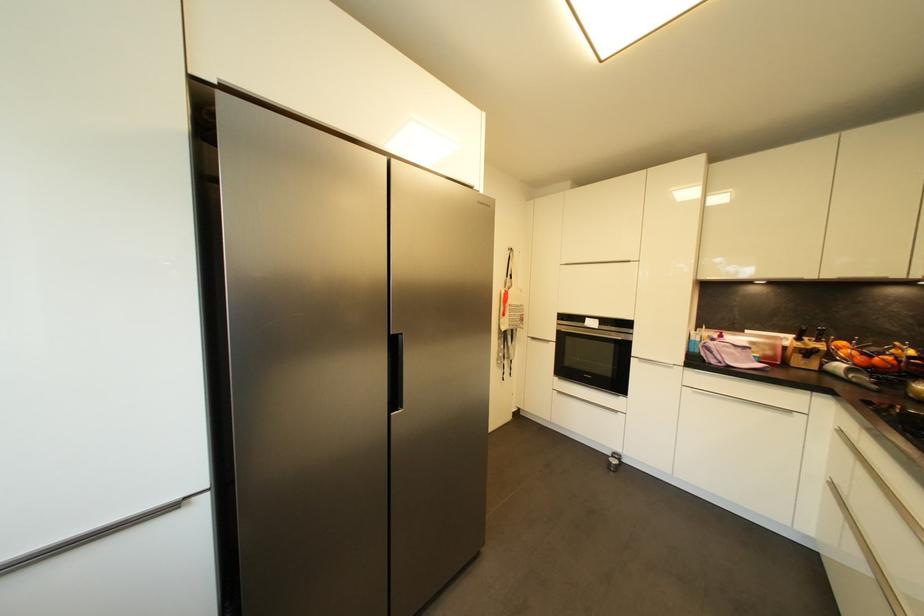
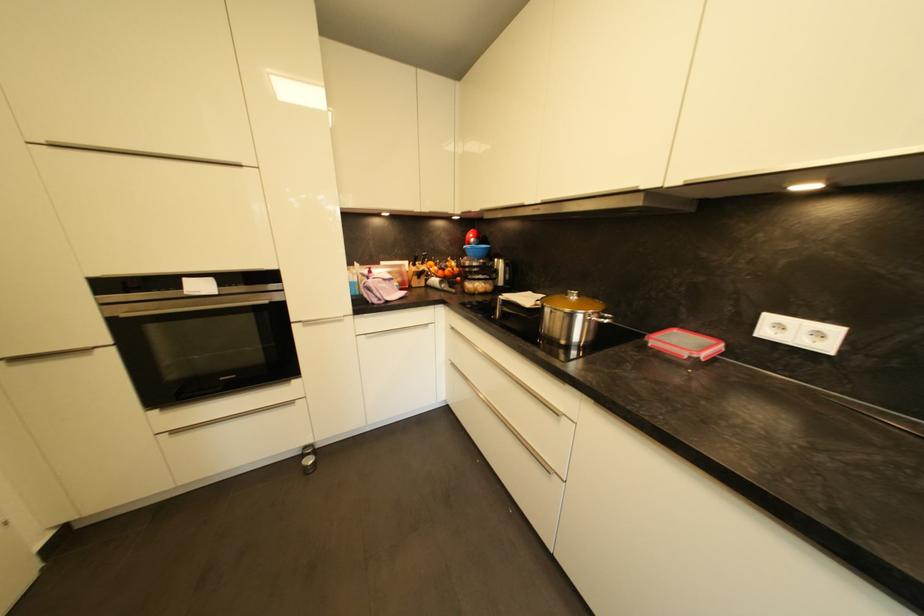
Find the pixel in the second image that matches point (618, 464) in the first image.

(313, 463)